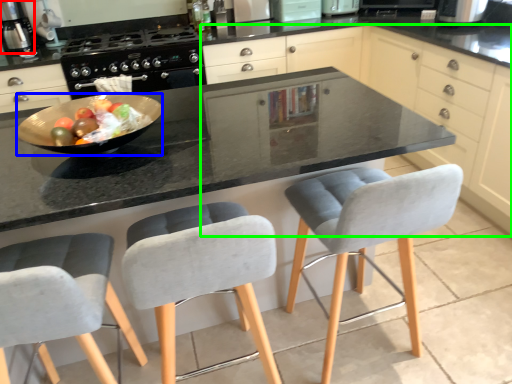
Question: Estimate the real-world distances between objects in this image. Which object is farther from kitchen appliance (highlighted by a red box), bowl (highlighted by a blue box) or cabinetry (highlighted by a green box)?

Choices:
 (A) bowl
 (B) cabinetry

Answer: (B)